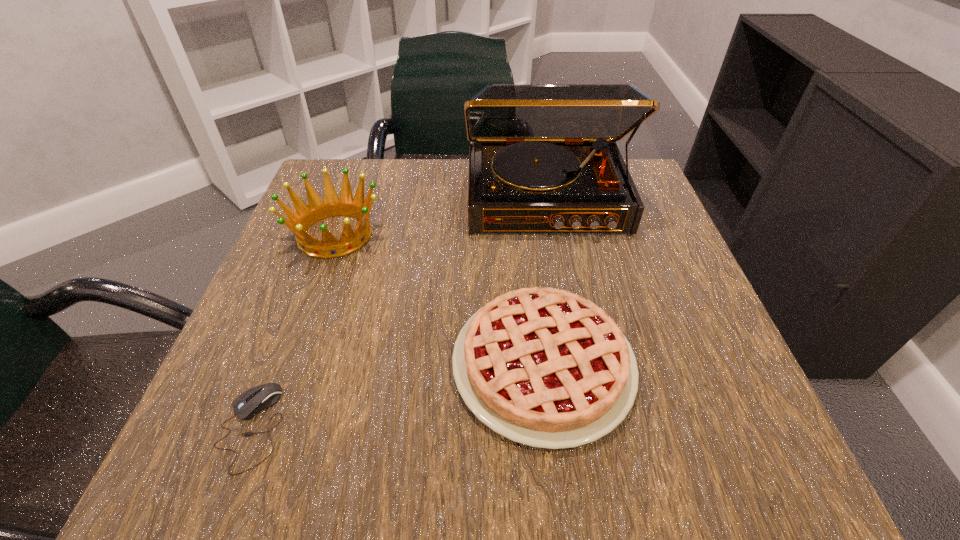
Where is `the tallest object`? This screenshot has height=540, width=960. the tallest object is located at coordinates (543, 158).

The image size is (960, 540). Find the location of `crown`. crown is located at coordinates (299, 222).

This screenshot has height=540, width=960. Identify the location of pie. (543, 367).

I want to click on the shortest object, so click(x=251, y=402).

This screenshot has height=540, width=960. I want to click on free space located on the front-facing side of the record player, so click(x=564, y=301).

The height and width of the screenshot is (540, 960). What are the coordinates of `vacant position located 0.110m on the right of the crown` in the screenshot? It's located at (439, 234).

The image size is (960, 540). What are the coordinates of `vacant area situated on the back of the second shortest object` in the screenshot? It's located at (532, 273).

Locate an element on the screen. blank space located on the back of the computer mouse is located at coordinates (305, 286).

Where is `record player located at the far edge`? record player located at the far edge is located at coordinates (543, 158).

You are a GUI agent. You are given a task and a screenshot of the screen. Output one action in this format:
    pyautogui.click(x=<x>, y=<y>)
    Task: Click on the crown that is at the far edge
    
    Given the screenshot: What is the action you would take?
    pyautogui.click(x=299, y=222)